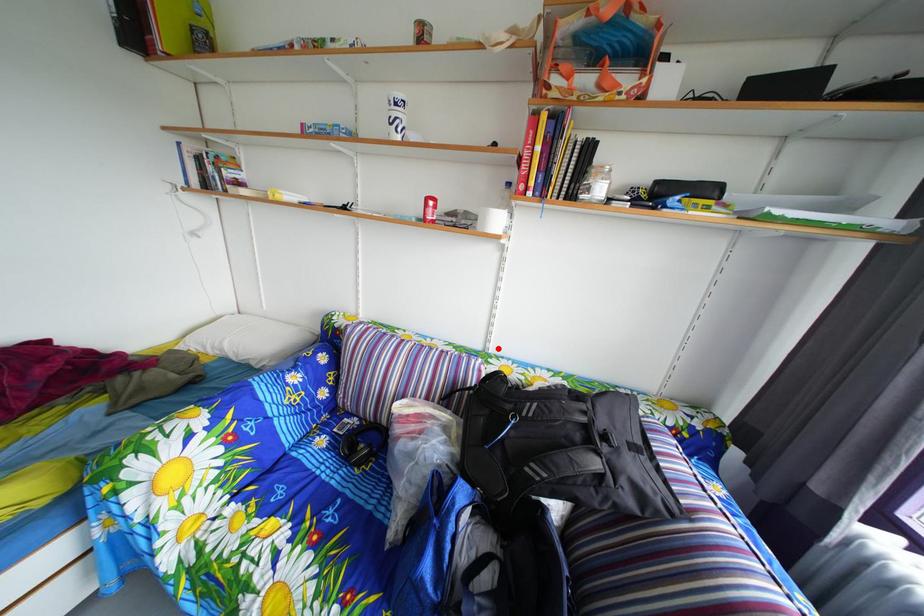
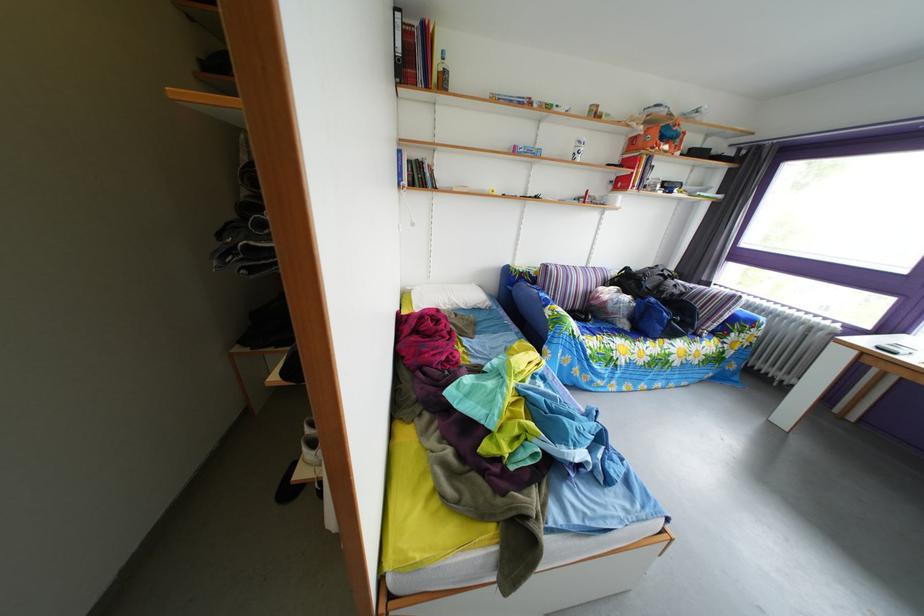
Locate, in the second image, the point that corresponds to the highlighted location in the first image.

(599, 270)